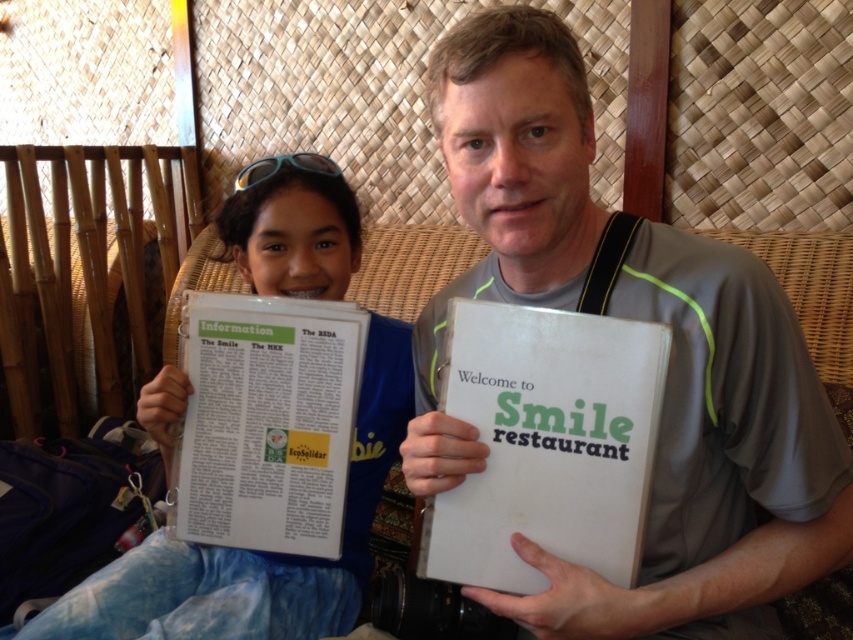
You are a customer at this place and need to choose between the white paper menu at center and the white paper information sheet at center. Which one is bigger?

The white paper menu at center is larger in size than the white paper information sheet at center.

You are a person who wants to order food. You see the white paper menu at center between two people. Can you reach it without moving either of them?

The two people are 27.73 inches apart, so yes, you can reach the white paper menu at center without moving either of them since the distance between them is sufficient.